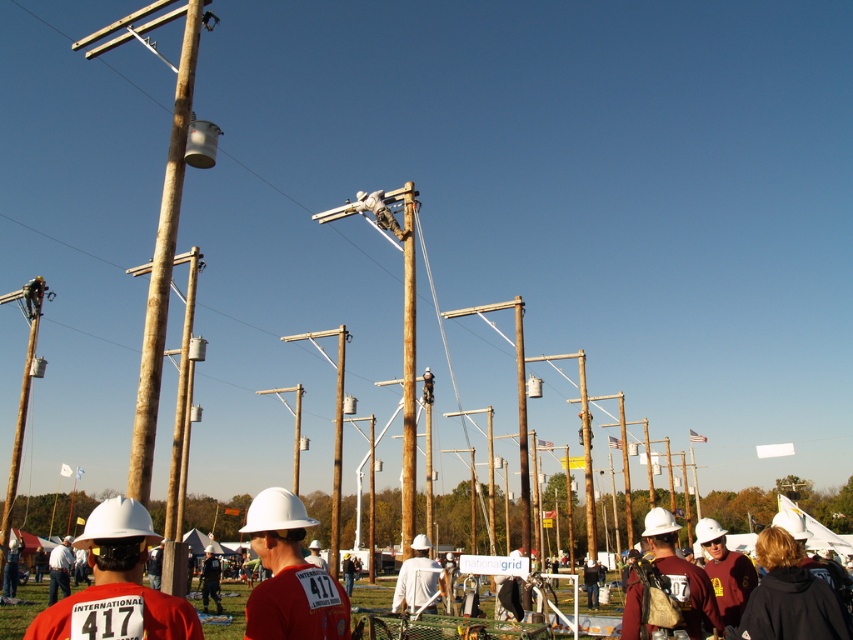
Looking at this image, between brown wooden telegraph pole at center and white hard hat at center, which one appears on the left side from the viewer's perspective?

From the viewer's perspective, white hard hat at center appears more on the left side.

Does brown wooden telegraph pole at center have a greater width compared to white hard hat at center?

In fact, brown wooden telegraph pole at center might be narrower than white hard hat at center.

The width and height of the screenshot is (853, 640). Describe the element at coordinates (334, 436) in the screenshot. I see `brown wooden telegraph pole at center` at that location.

Where is `brown wooden telegraph pole at center`? brown wooden telegraph pole at center is located at coordinates (334, 436).

Is matte white hard hat at lower right positioned in front of white hard hat at center?

Yes, matte white hard hat at lower right is in front of white hard hat at center.

The height and width of the screenshot is (640, 853). Identify the location of matte white hard hat at lower right. 680,573.

Is point (401, 488) positioned behind point (306, 337)?

Yes, point (401, 488) is farther from viewer.

Measure the distance between rusty wood telegraph pole at upper center and brown wooden telegraph pole at center.

rusty wood telegraph pole at upper center and brown wooden telegraph pole at center are 8.05 meters apart from each other.

Between point (409, 250) and point (334, 554), which one is positioned in front?

Point (409, 250) is more forward.

Where is `rusty wood telegraph pole at upper center`? rusty wood telegraph pole at upper center is located at coordinates (407, 365).